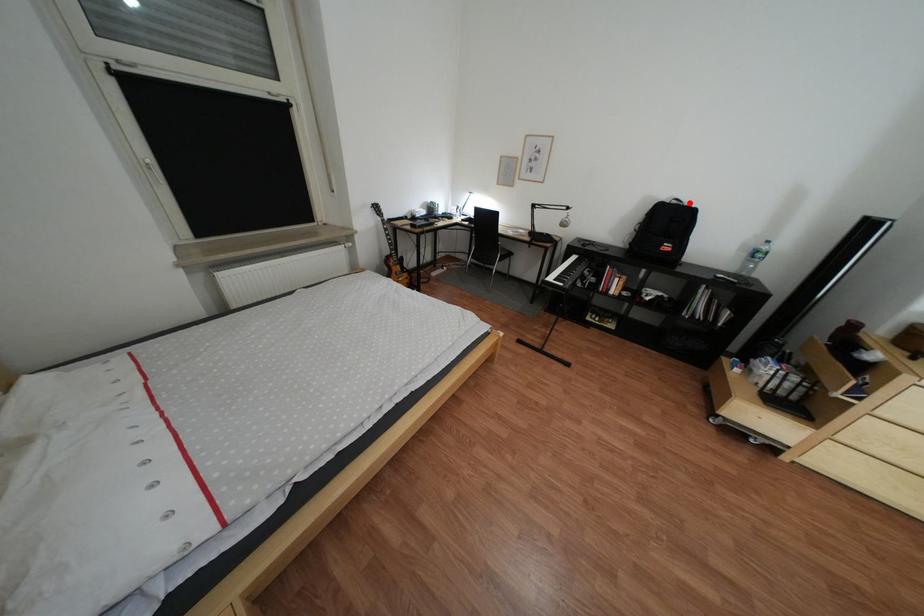
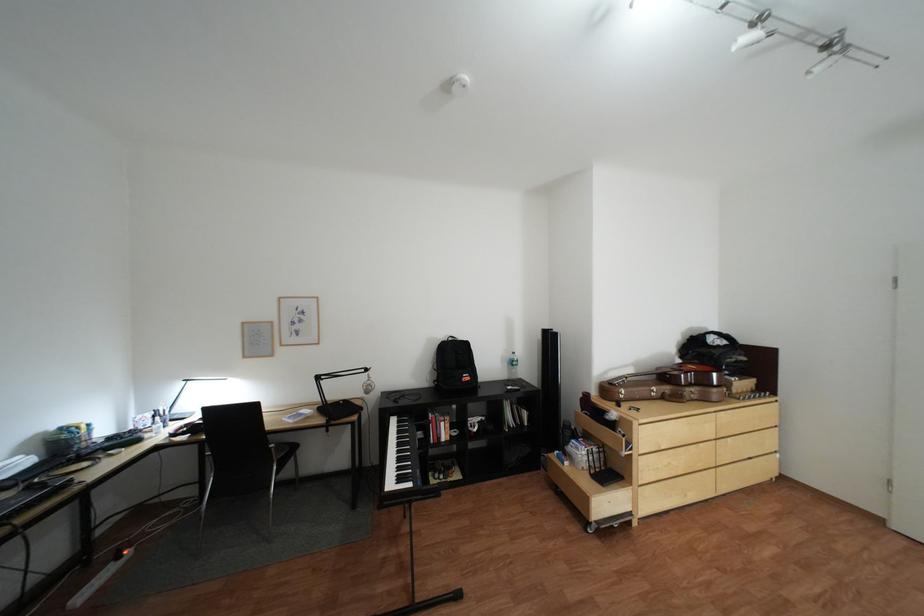
The point at the highlighted location is marked in the first image. Where is the corresponding point in the second image?

(466, 339)